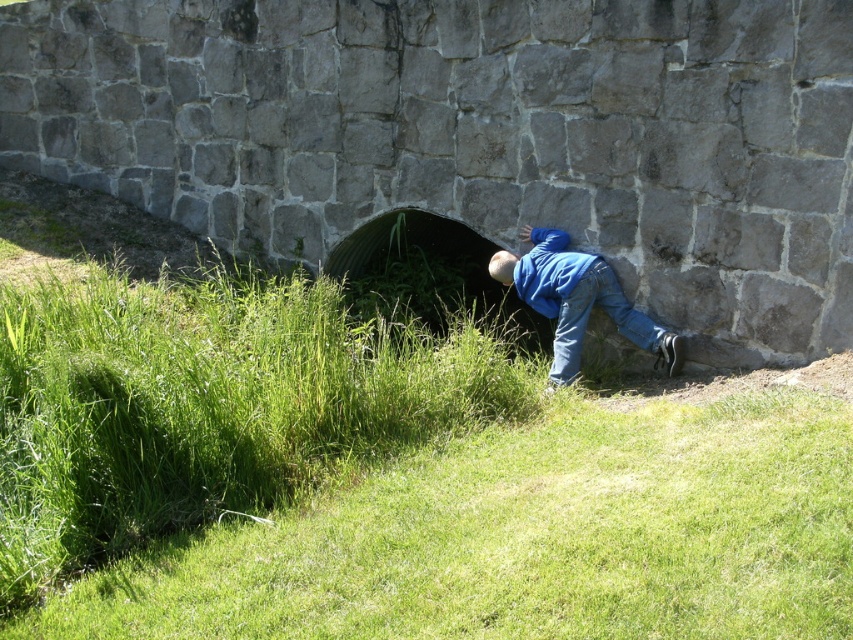
Question: Which of the following is the farthest from the observer?

Choices:
 (A) blue denim jeans at lower right
 (B) green grass at lower left

Answer: (A)

Question: Does green grass at lower left have a lesser width compared to blue denim jeans at lower right?

Choices:
 (A) no
 (B) yes

Answer: (A)

Question: Which of the following is the closest to the observer?

Choices:
 (A) blue denim jeans at lower center
 (B) green corrugated metal tunnel at center

Answer: (A)

Question: In this image, where is blue denim jeans at lower right located relative to blue denim jeans at lower center?

Choices:
 (A) right
 (B) left

Answer: (B)

Question: In this image, where is green corrugated metal tunnel at center located relative to blue denim jeans at lower right?

Choices:
 (A) right
 (B) left

Answer: (B)

Question: Which of the following is the closest to the observer?

Choices:
 (A) blue denim jeans at lower right
 (B) green grass at lower left
 (C) green corrugated metal tunnel at center

Answer: (B)